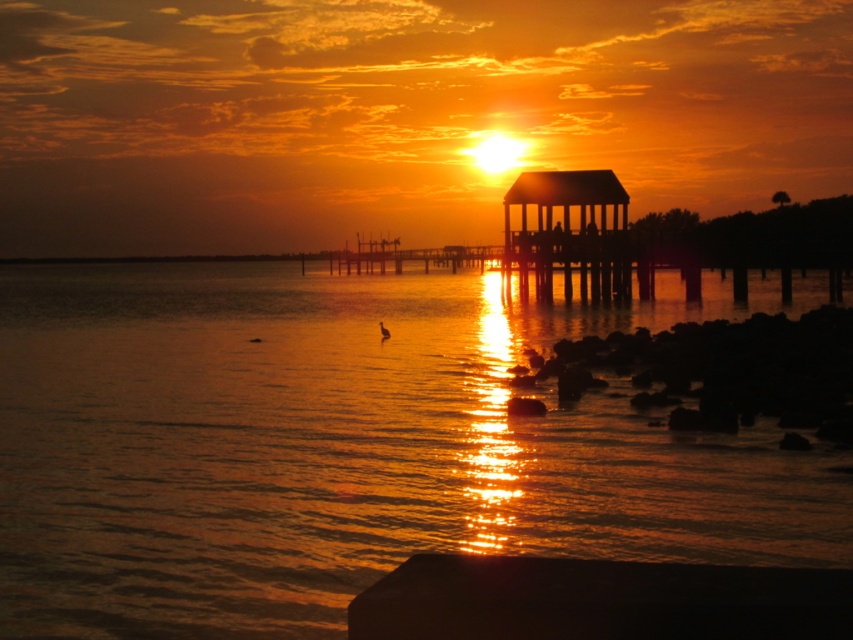
Question: Which object appears closest to the camera in this image?

Choices:
 (A) shiny reflective water at center
 (B) wooden gazebo at upper right

Answer: (A)

Question: Is shiny reflective water at center in front of wooden gazebo at upper right?

Choices:
 (A) no
 (B) yes

Answer: (B)

Question: Considering the real-world distances, which object is farthest from the wooden gazebo at upper right?

Choices:
 (A) shiny reflective water at center
 (B) smooth concrete pier at center

Answer: (B)

Question: Does smooth concrete pier at center come behind wooden gazebo at upper right?

Choices:
 (A) yes
 (B) no

Answer: (B)

Question: Is the position of smooth concrete pier at center more distant than that of wooden gazebo at upper right?

Choices:
 (A) no
 (B) yes

Answer: (A)

Question: Estimate the real-world distances between objects in this image. Which object is closer to the wooden gazebo at upper right?

Choices:
 (A) shiny reflective water at center
 (B) smooth concrete pier at center

Answer: (A)